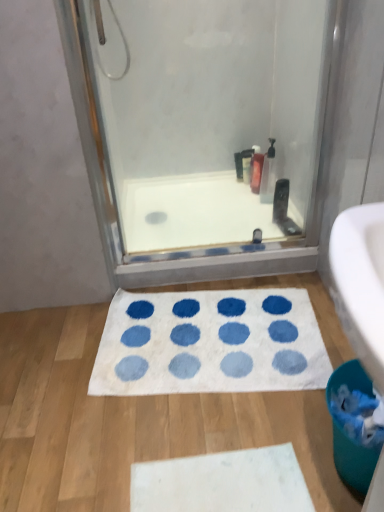
The image size is (384, 512). I want to click on vacant area that lies between white soft bath mat at center and teal plastic toilet bowl at lower right, so click(236, 422).